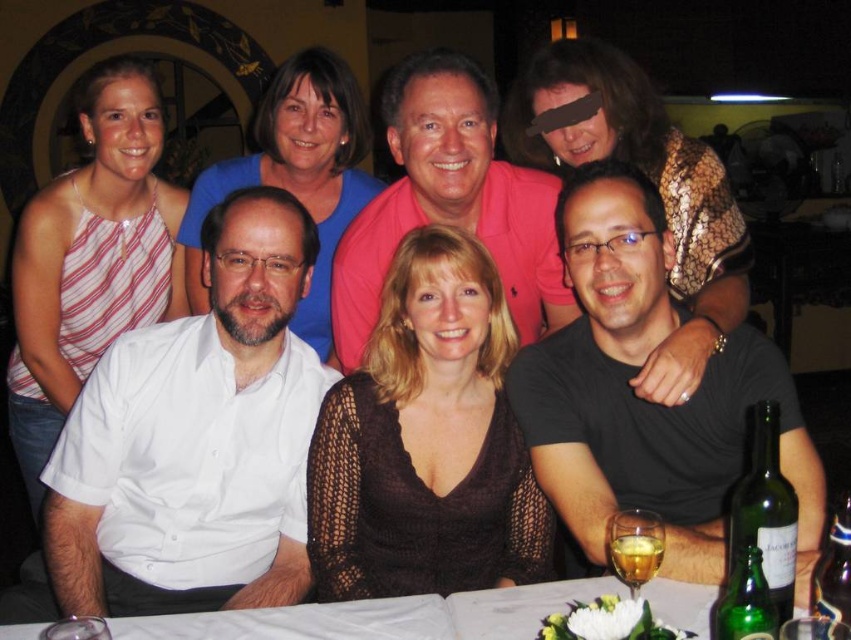
You are a photographer trying to adjust the lighting for a group photo. You notice two shirts in the image, the white shirt at left and the pink matte shirt at center. Which shirt takes up more space in the photo?

The pink matte shirt at center takes up more space in the photo because the white shirt at left occupies less space than the pink matte shirt at center.

Looking at this image, you are a photographer at the event and need to adjust the lighting to ensure both the white shirt at left and the pink matte shirt at center are well lit. Given their positions, which shirt is closer to the floor and might need more downward lighting?

The white shirt at left is below the pink matte shirt at center, so it is closer to the floor and may require more downward lighting to ensure proper illumination.

Based on the photo, you are a server at the restaurant and need to deliver a napkin to the person wearing the black matte shirt at center. The napkin is currently placed at the green glass beer at lower right. Can you reach the napkin without moving any other items on the table?

The distance between the black matte shirt at center and the green glass beer at lower right is 36.17 centimeters. Since the napkin is at the green glass beer at lower right, you can reach it by extending your arm across the 36.17 cm gap to the black matte shirt at center.